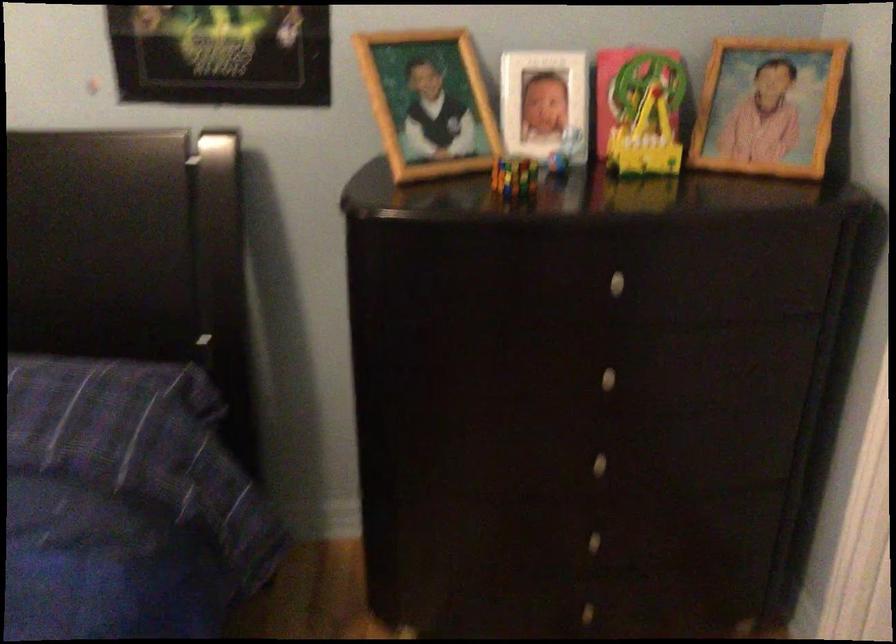
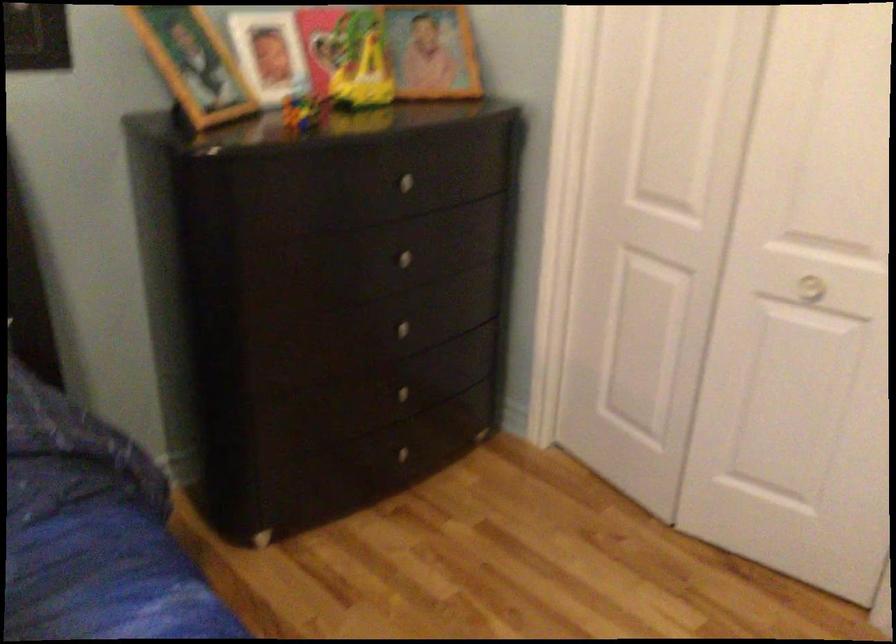
In the second image, find the point that corresponds to (599,373) in the first image.

(399, 258)